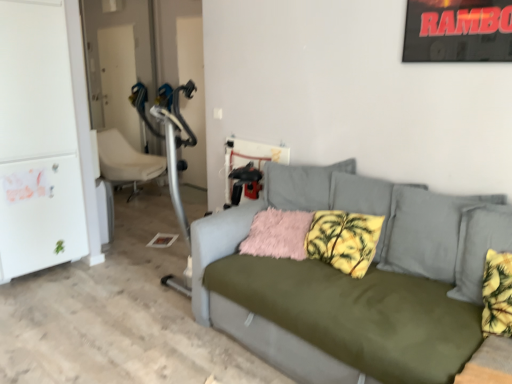
The height and width of the screenshot is (384, 512). Identify the location of unoccupied region to the right of white matte refrigerator at left. (113, 259).